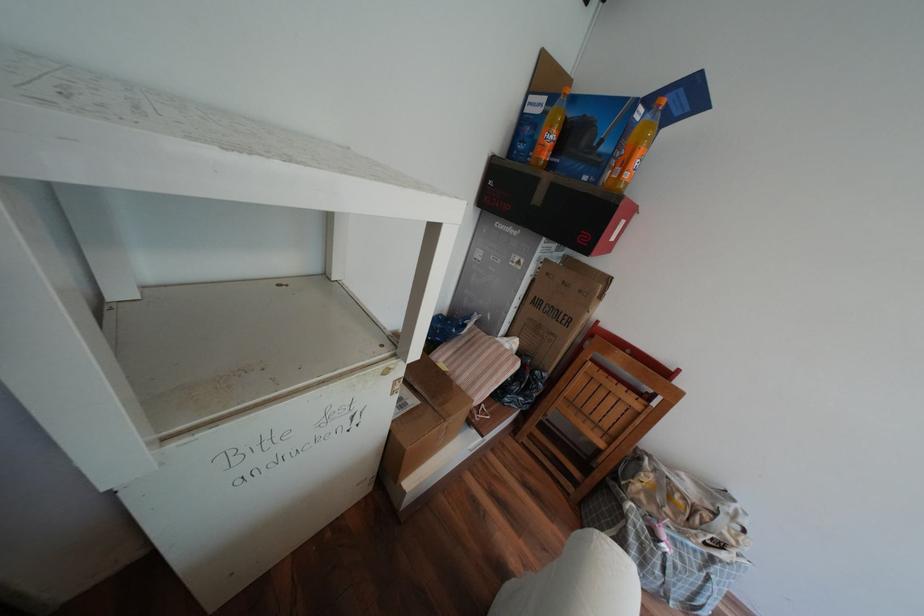
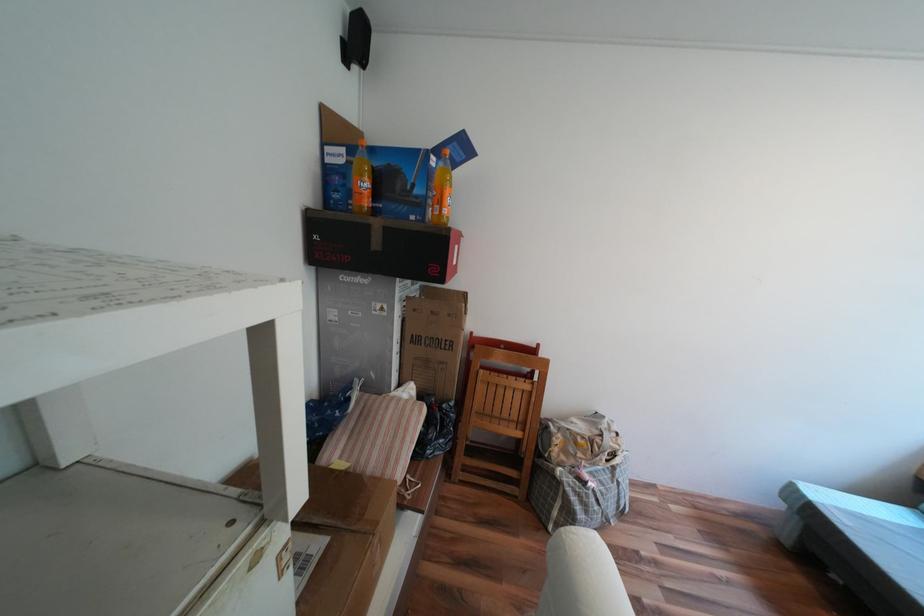
Question: Based on the continuous images, in which direction is the camera rotating? Reply with the corresponding letter.

Choices:
 (A) Left
 (B) Right
 (C) Up
 (D) Down

Answer: (B)